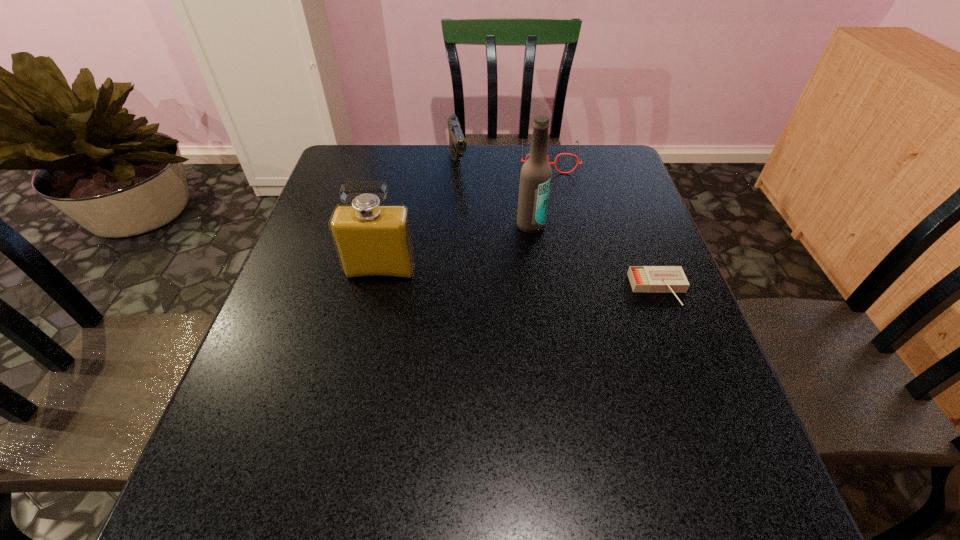
Identify which object is the fourth closest to the second tallest object. Please provide its 2D coordinates. Your answer should be formatted as a tuple, i.e. [(x, y)], where the tuple contains the x and y coordinates of a point satisfying the conditions above.

[(642, 278)]

Identify which object is the third closest to the shortest object. Please provide its 2D coordinates. Your answer should be formatted as a tuple, i.e. [(x, y)], where the tuple contains the x and y coordinates of a point satisfying the conditions above.

[(373, 241)]

Locate an element on the screen. free space that satisfies the following two spatial constraints: 1. on the back side of the second shortest object; 2. on the right side of the third farthest object is located at coordinates (522, 158).

Identify the location of free space that satisfies the following two spatial constraints: 1. on the back side of the second shortest object; 2. on the left side of the tallest object. The width and height of the screenshot is (960, 540). (522, 158).

You are a GUI agent. You are given a task and a screenshot of the screen. Output one action in this format:
    pyautogui.click(x=<x>, y=<y>)
    Task: Click on the vacant area that satisfies the following two spatial constraints: 1. on the back side of the fourth tallest object; 2. on the right side of the third tallest object
    
    Given the screenshot: What is the action you would take?
    pyautogui.click(x=458, y=158)